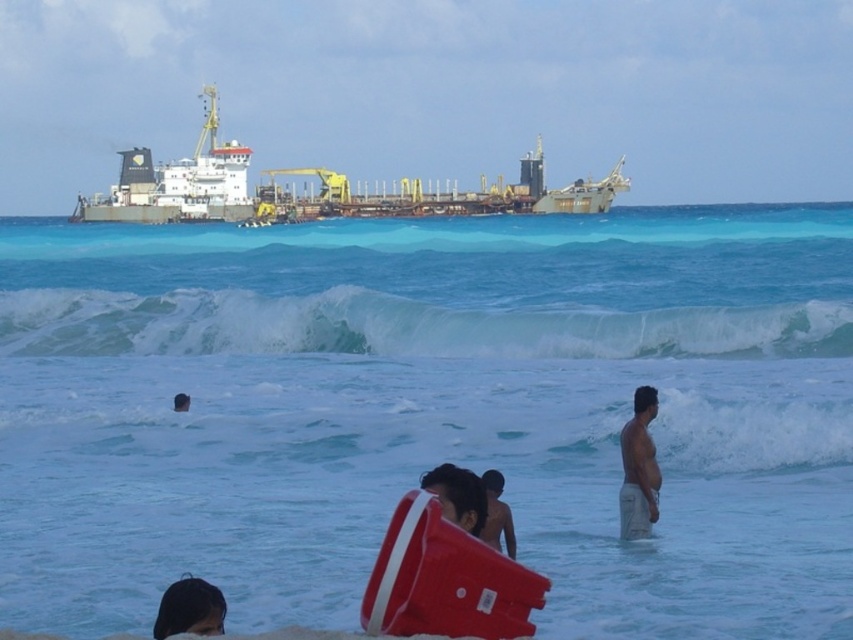
You are a photographer trying to capture the entire green metallic ship at upper center and dark brown hair at lower left in one frame. Considering their sizes, which object should you focus on to ensure both fit in the photo?

The green metallic ship at upper center is larger in width than the dark brown hair at lower left, so you should focus on the green metallic ship at upper center to ensure both fit in the photo.